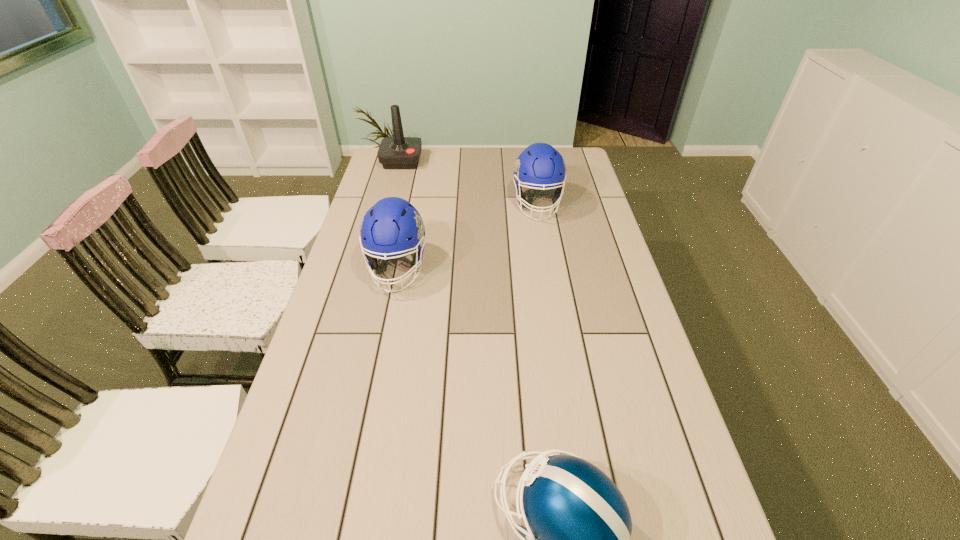
The height and width of the screenshot is (540, 960). Identify the location of joystick. (398, 152).

Where is `the second nearest football helmet`? This screenshot has width=960, height=540. the second nearest football helmet is located at coordinates (386, 226).

This screenshot has height=540, width=960. I want to click on the second nearest object, so click(x=386, y=226).

Identify the location of the second farthest object. (540, 166).

The image size is (960, 540). Find the location of `vacant space located on the right of the joystick`. vacant space located on the right of the joystick is located at coordinates (493, 161).

Where is `vacant space located 0.210m on the face guard of the second farthest football helmet`? The width and height of the screenshot is (960, 540). vacant space located 0.210m on the face guard of the second farthest football helmet is located at coordinates (379, 356).

Where is `free space located on the front-facing side of the third nearest object`? This screenshot has width=960, height=540. free space located on the front-facing side of the third nearest object is located at coordinates (545, 252).

Where is `object that is positioned at the far edge`? Image resolution: width=960 pixels, height=540 pixels. object that is positioned at the far edge is located at coordinates (398, 152).

The height and width of the screenshot is (540, 960). I want to click on joystick present at the left edge, so click(398, 152).

Locate an element on the screen. This screenshot has height=540, width=960. football helmet at the left edge is located at coordinates (386, 226).